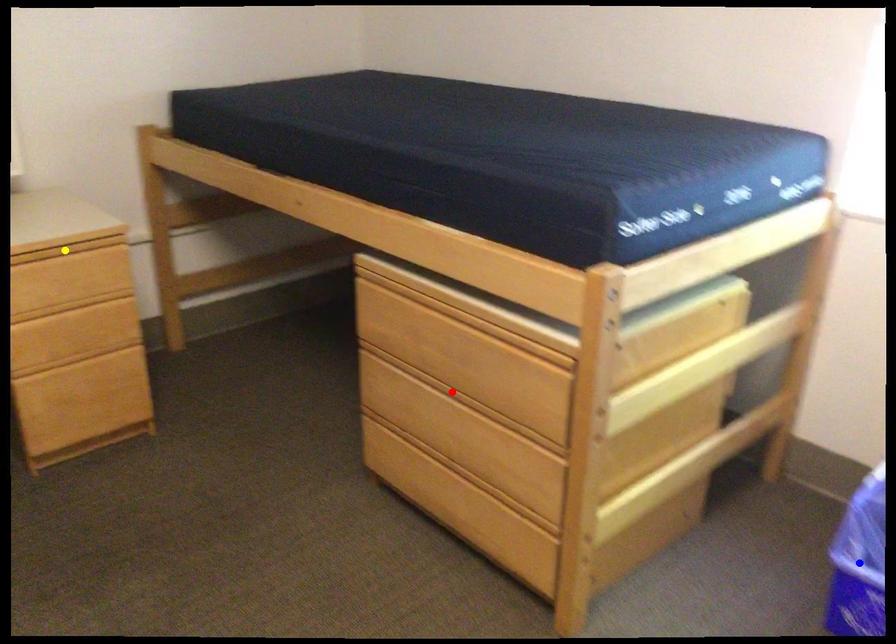
Order these from farthest to nearest:
red point | blue point | yellow point

yellow point, red point, blue point